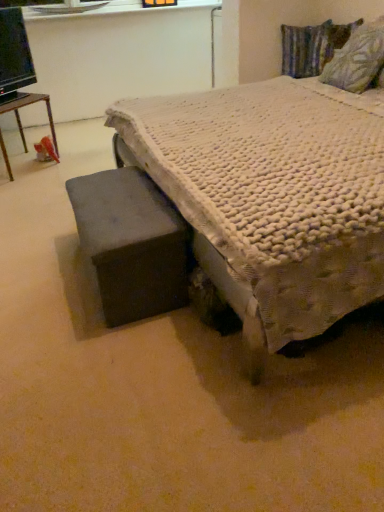
Question: Considering the relative positions of dark gray fabric ottoman at lower left and wooden table at left in the image provided, is dark gray fabric ottoman at lower left to the left or to the right of wooden table at left?

Choices:
 (A) right
 (B) left

Answer: (A)

Question: Is point (102, 297) closer or farther from the camera than point (18, 97)?

Choices:
 (A) closer
 (B) farther

Answer: (A)

Question: Which object is the closest to the textured multicolored pillow at upper right, the 2th pillow in the bottom-to-top sequence?

Choices:
 (A) white textured bed at center
 (B) wooden table at left
 (C) textured fabric pillow at upper right, arranged as the 2th pillow when viewed from the top
 (D) dark gray fabric ottoman at lower left
 (E) black glossy computer monitor at upper left

Answer: (C)

Question: Considering the real-world distances, which object is farthest from the wooden table at left?

Choices:
 (A) textured fabric pillow at upper right, the second pillow viewed from the back
 (B) white textured bed at center
 (C) textured multicolored pillow at upper right, the 2th pillow positioned from the front
 (D) dark gray fabric ottoman at lower left
 (E) black glossy computer monitor at upper left

Answer: (A)